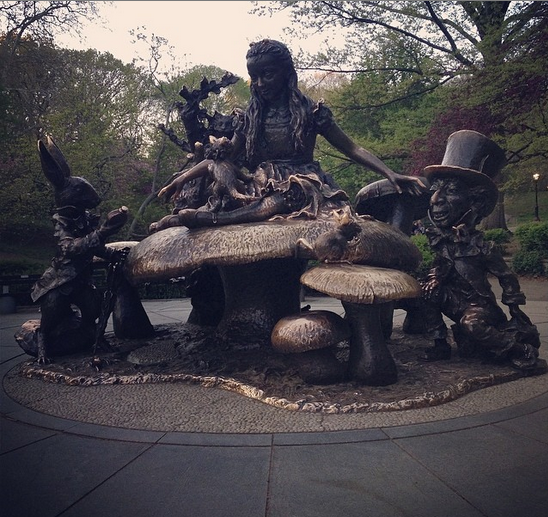
The width and height of the screenshot is (548, 517). Identify the location of clock. (119, 211).